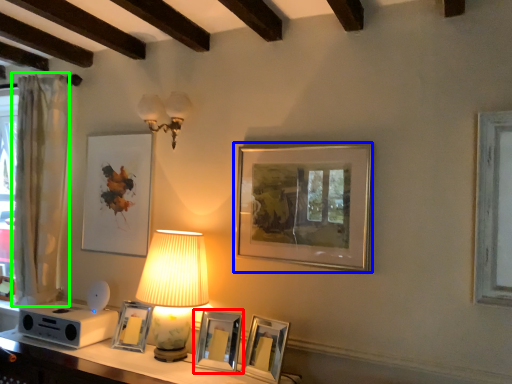
Question: Which is nearer to the picture frame (highlighted by a red box)? picture frame (highlighted by a blue box) or curtain (highlighted by a green box).

Choices:
 (A) picture frame
 (B) curtain

Answer: (A)